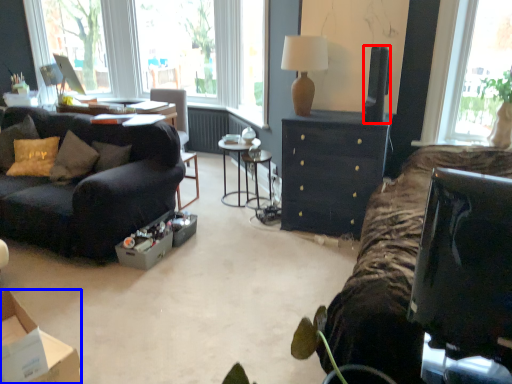
Question: Which point is closer to the camera, television (highlighted by a red box) or box (highlighted by a blue box)?

Choices:
 (A) television
 (B) box

Answer: (B)